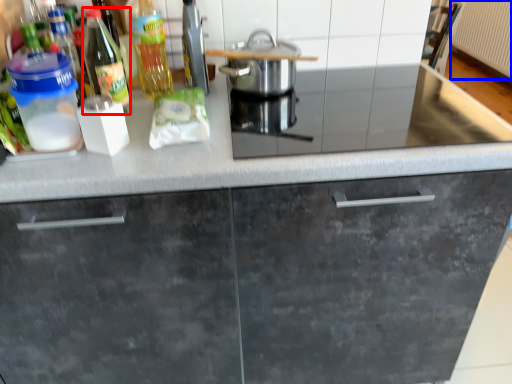
Question: Which point is further to the camera, bottle (highlighted by a red box) or radiator (highlighted by a blue box)?

Choices:
 (A) bottle
 (B) radiator

Answer: (B)